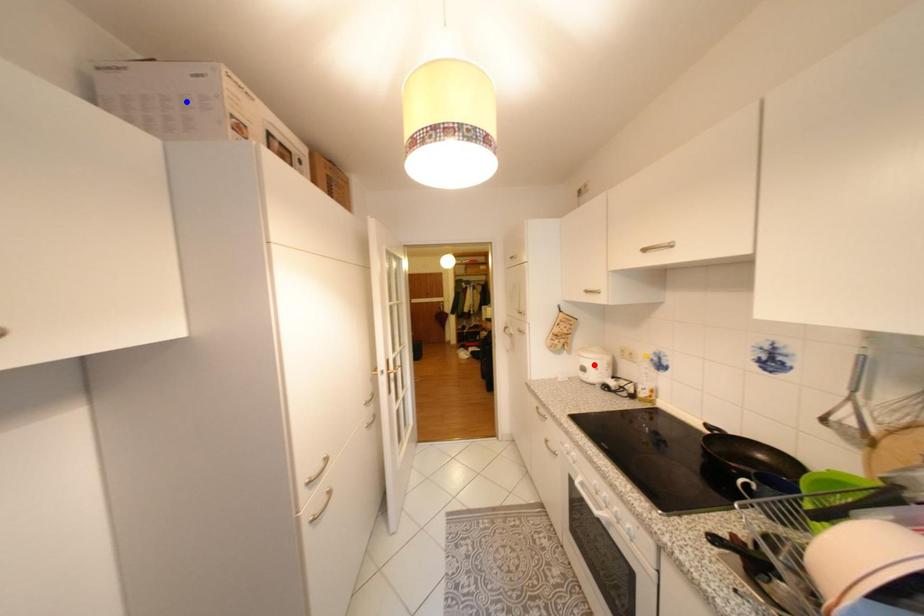
Question: Two points are marked on the image. Which point is closer to the camera?

Choices:
 (A) Blue point is closer.
 (B) Red point is closer.

Answer: (A)